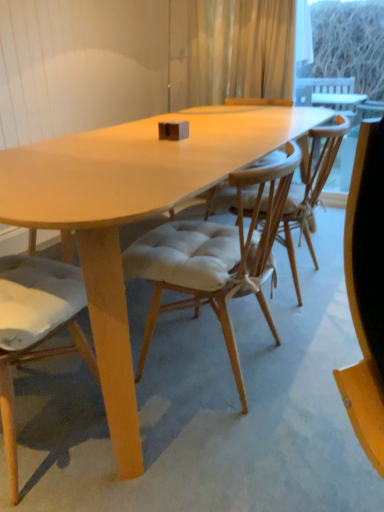
Identify the location of vacant region below light brown wood chair at center, the 2th chair viewed from the right (from a real-world perspective). This screenshot has height=512, width=384. (49, 411).